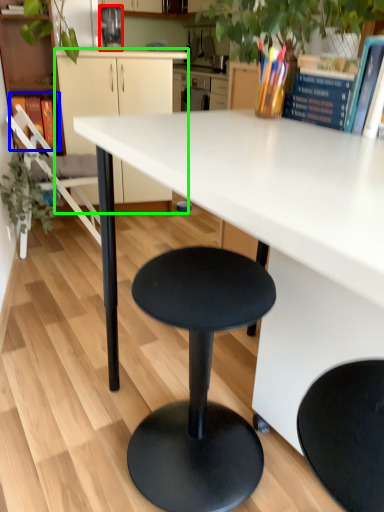
Question: Based on their relative distances, which object is farther from appliance (highlighted by a red box)? Choose from book (highlighted by a blue box) and cabinetry (highlighted by a green box).

Choices:
 (A) book
 (B) cabinetry

Answer: (A)